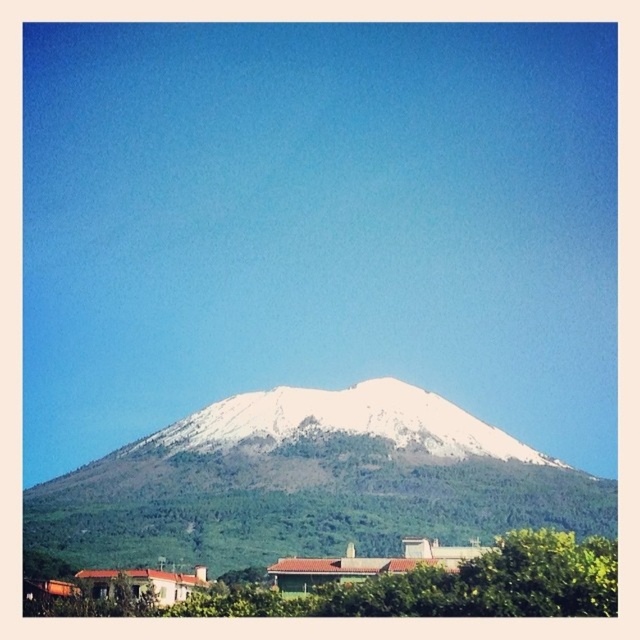
Question: Which point appears farthest from the camera in this image?

Choices:
 (A) (212, 436)
 (B) (106, 458)

Answer: (B)

Question: Does snowy rock mountain at center appear over white snow-covered mountain at center?

Choices:
 (A) no
 (B) yes

Answer: (A)

Question: Which of the following is the closest to the observer?

Choices:
 (A) snowy rock mountain at center
 (B) white snow-covered mountain at center

Answer: (A)

Question: Can you confirm if snowy rock mountain at center is positioned to the right of white snow-covered mountain at center?

Choices:
 (A) yes
 (B) no

Answer: (B)

Question: Can you confirm if snowy rock mountain at center is wider than white snow-covered mountain at center?

Choices:
 (A) no
 (B) yes

Answer: (B)